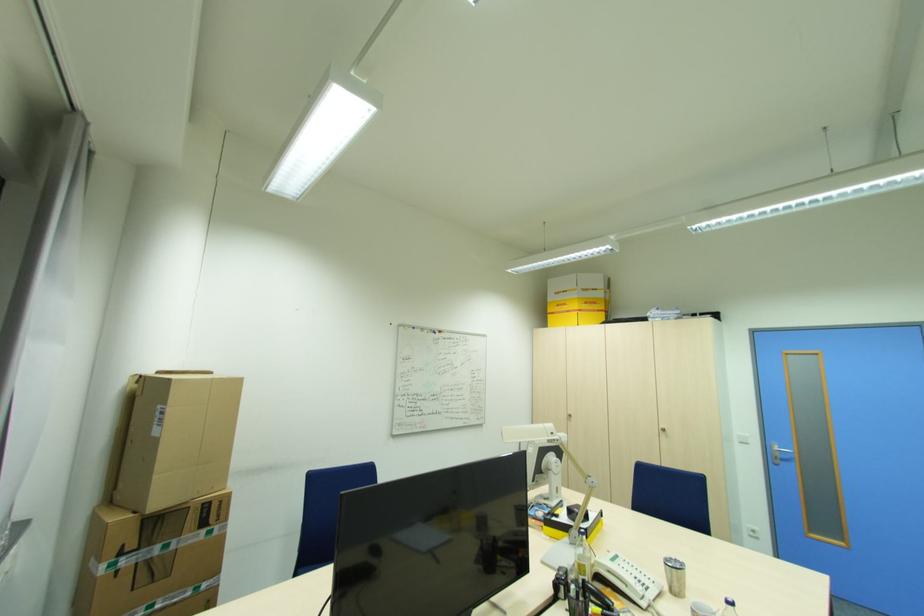
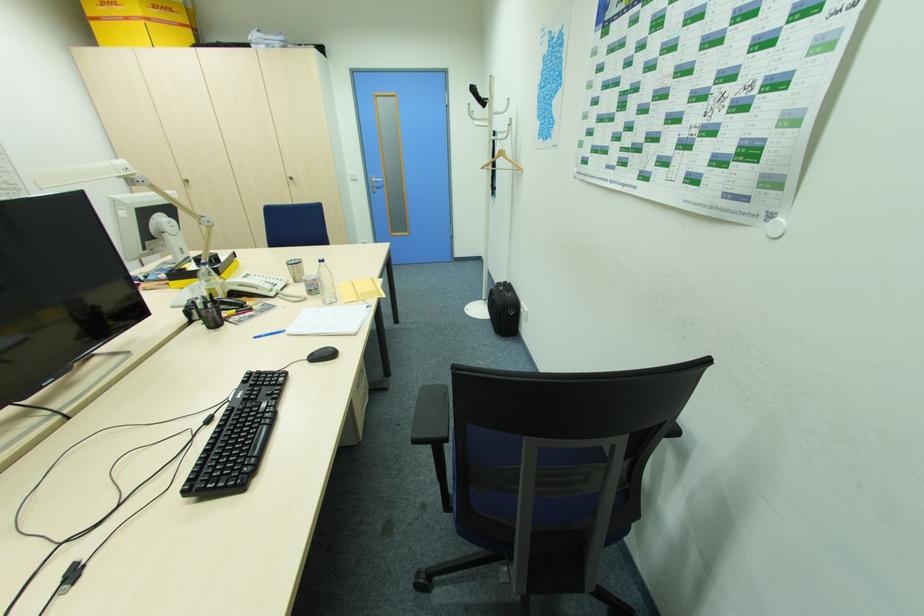
Where in the second image is the point corresponding to point 650,588 from the first image?

(280, 285)